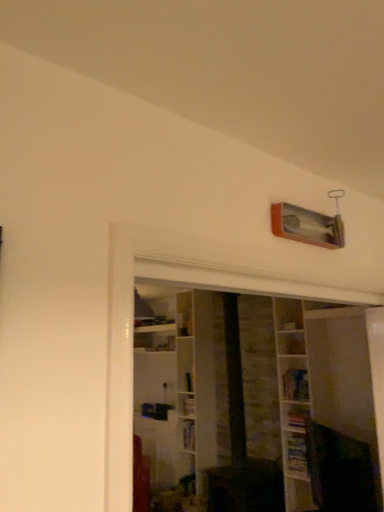
Image resolution: width=384 pixels, height=512 pixels. Identify the location of white wooden shelf at center. (293, 400).

Image resolution: width=384 pixels, height=512 pixels. Describe the element at coordinates (295, 384) in the screenshot. I see `hardcover book at upper center, the 3th book positioned from the bottom` at that location.

This screenshot has height=512, width=384. Describe the element at coordinates (296, 453) in the screenshot. I see `hardcover book at lower right, the 3th book from the top` at that location.

In order to click on hardcover book at lower right, the 3th book from the top in this screenshot , I will do `click(296, 453)`.

Describe the element at coordinates (297, 416) in the screenshot. I see `hardcover book at lower right, placed as the second book when sorted from top to bottom` at that location.

Find the location of a particular element. The image size is (384, 512). white wooden shelf at center is located at coordinates (293, 400).

Is hardcover book at lower right, positioned as the second book in bottom-to-top order, far from hardcover book at lower right, positioned as the 1th book in bottom-to-top order?

No, hardcover book at lower right, positioned as the second book in bottom-to-top order, is not far away from hardcover book at lower right, positioned as the 1th book in bottom-to-top order.

From a real-world perspective, which object rests below the other?

From a 3D spatial view, hardcover book at lower right, positioned as the 1th book in bottom-to-top order, is below.

Which is in front, hardcover book at lower right, positioned as the second book in bottom-to-top order, or hardcover book at lower right, the 3th book from the top?

hardcover book at lower right, the 3th book from the top, is more forward.

In terms of width, does hardcover book at lower right, positioned as the second book in bottom-to-top order, look wider or thinner when compared to hardcover book at lower right, positioned as the 1th book in bottom-to-top order?

Considering their sizes, hardcover book at lower right, positioned as the second book in bottom-to-top order, looks broader than hardcover book at lower right, positioned as the 1th book in bottom-to-top order.

Would you say white wooden shelf at center is a long distance from hardcover book at lower right, placed as the second book when sorted from top to bottom?

That's not correct — white wooden shelf at center is a little close to hardcover book at lower right, placed as the second book when sorted from top to bottom.

Considering the sizes of objects white wooden shelf at center and hardcover book at lower right, placed as the second book when sorted from top to bottom, in the image provided, who is smaller, white wooden shelf at center or hardcover book at lower right, placed as the second book when sorted from top to bottom,?

With smaller size is hardcover book at lower right, placed as the second book when sorted from top to bottom.

Is white wooden shelf at center at the right side of hardcover book at lower right, positioned as the second book in bottom-to-top order?

Yes.

In the image, is white wooden shelf at center positioned in front of or behind hardcover book at lower right, positioned as the second book in bottom-to-top order?

Clearly, white wooden shelf at center is in front of hardcover book at lower right, positioned as the second book in bottom-to-top order.

Where is `shelf in front of the hardcover book at lower right, positioned as the second book in bottom-to-top order`? The width and height of the screenshot is (384, 512). shelf in front of the hardcover book at lower right, positioned as the second book in bottom-to-top order is located at coordinates (293, 400).

From the image's perspective, is hardcover book at lower right, placed as the second book when sorted from top to bottom, under white wooden shelf at center?

Correct, hardcover book at lower right, placed as the second book when sorted from top to bottom, appears lower than white wooden shelf at center in the image.

Is hardcover book at lower right, positioned as the second book in bottom-to-top order, at the left side of white wooden shelf at center?

Correct, you'll find hardcover book at lower right, positioned as the second book in bottom-to-top order, to the left of white wooden shelf at center.

From a real-world perspective, between hardcover book at lower right, placed as the second book when sorted from top to bottom, and hardcover book at upper center, which appears as the 1th book when viewed from the top, who is vertically lower?

hardcover book at lower right, placed as the second book when sorted from top to bottom, is physically lower.

How distant is hardcover book at lower right, placed as the second book when sorted from top to bottom, from hardcover book at upper center, which appears as the 1th book when viewed from the top?

A distance of 6.55 inches exists between hardcover book at lower right, placed as the second book when sorted from top to bottom, and hardcover book at upper center, which appears as the 1th book when viewed from the top.

Which is behind, point (294, 409) or point (296, 393)?

Point (296, 393)

How different are the orientations of hardcover book at lower right, positioned as the second book in bottom-to-top order, and hardcover book at upper center, which appears as the 1th book when viewed from the top, in degrees?

The facing directions of hardcover book at lower right, positioned as the second book in bottom-to-top order, and hardcover book at upper center, which appears as the 1th book when viewed from the top, are 0.0632 degrees apart.

Could you tell me if hardcover book at lower right, the 3th book from the top, is facing white wooden shelf at center?

Yes, hardcover book at lower right, the 3th book from the top, is facing white wooden shelf at center.

Is hardcover book at lower right, the 3th book from the top, touching white wooden shelf at center?

No, hardcover book at lower right, the 3th book from the top, is not touching white wooden shelf at center.

Which point is more distant from viewer, (x=292, y=463) or (x=279, y=333)?

Point (x=279, y=333)

In the image, is hardcover book at lower right, the 3th book from the top, positioned in front of or behind hardcover book at upper center, which appears as the 1th book when viewed from the top?

hardcover book at lower right, the 3th book from the top, is positioned closer to the viewer than hardcover book at upper center, which appears as the 1th book when viewed from the top.

Is hardcover book at lower right, positioned as the 1th book in bottom-to-top order, to the left of hardcover book at upper center, which appears as the 1th book when viewed from the top, from the viewer's perspective?

Yes, hardcover book at lower right, positioned as the 1th book in bottom-to-top order, is to the left of hardcover book at upper center, which appears as the 1th book when viewed from the top.

From a real-world perspective, who is located lower, hardcover book at lower right, positioned as the 1th book in bottom-to-top order, or hardcover book at upper center, which appears as the 1th book when viewed from the top?

From a 3D spatial view, hardcover book at lower right, positioned as the 1th book in bottom-to-top order, is below.

Is hardcover book at lower right, positioned as the 1th book in bottom-to-top order, in contact with hardcover book at upper center, which appears as the 1th book when viewed from the top?

hardcover book at lower right, positioned as the 1th book in bottom-to-top order, and hardcover book at upper center, which appears as the 1th book when viewed from the top, are not in contact.

Considering the relative sizes of hardcover book at upper center, the 3th book positioned from the bottom, and hardcover book at lower right, positioned as the second book in bottom-to-top order, in the image provided, is hardcover book at upper center, the 3th book positioned from the bottom, shorter than hardcover book at lower right, positioned as the second book in bottom-to-top order,?

Incorrect, the height of hardcover book at upper center, the 3th book positioned from the bottom, does not fall short of that of hardcover book at lower right, positioned as the second book in bottom-to-top order.

Who is bigger, hardcover book at upper center, which appears as the 1th book when viewed from the top, or hardcover book at lower right, placed as the second book when sorted from top to bottom?

hardcover book at upper center, which appears as the 1th book when viewed from the top, is bigger.

Considering the sizes of objects hardcover book at upper center, which appears as the 1th book when viewed from the top, and hardcover book at lower right, placed as the second book when sorted from top to bottom, in the image provided, who is thinner, hardcover book at upper center, which appears as the 1th book when viewed from the top, or hardcover book at lower right, placed as the second book when sorted from top to bottom,?

With smaller width is hardcover book at lower right, placed as the second book when sorted from top to bottom.

From the image's perspective, which object appears higher, hardcover book at upper center, the 3th book positioned from the bottom, or hardcover book at lower right, placed as the second book when sorted from top to bottom?

From the image's view, hardcover book at upper center, the 3th book positioned from the bottom, is above.

Where is `book below the hardcover book at lower right, positioned as the second book in bottom-to-top order (from the image's perspective)`? This screenshot has width=384, height=512. book below the hardcover book at lower right, positioned as the second book in bottom-to-top order (from the image's perspective) is located at coordinates (296, 453).

I want to click on shelf that is above the hardcover book at lower right, placed as the second book when sorted from top to bottom (from a real-world perspective), so click(x=293, y=400).

Looking at this image, which object lies nearer to the anchor point white wooden shelf at center, hardcover book at upper center, the 3th book positioned from the bottom, or hardcover book at lower right, positioned as the second book in bottom-to-top order?

Among the two, hardcover book at upper center, the 3th book positioned from the bottom, is located nearer to white wooden shelf at center.

Which object lies further to the anchor point white wooden shelf at center, hardcover book at lower right, placed as the second book when sorted from top to bottom, or hardcover book at upper center, which appears as the 1th book when viewed from the top?

hardcover book at lower right, placed as the second book when sorted from top to bottom.

Considering their positions, is hardcover book at lower right, placed as the second book when sorted from top to bottom, positioned closer to white wooden shelf at center than hardcover book at lower right, the 3th book from the top?

hardcover book at lower right, the 3th book from the top, is closer to white wooden shelf at center.

When comparing their distances from hardcover book at upper center, the 3th book positioned from the bottom, does hardcover book at lower right, the 3th book from the top, or hardcover book at lower right, positioned as the second book in bottom-to-top order, seem closer?

hardcover book at lower right, positioned as the second book in bottom-to-top order, is positioned closer to the anchor hardcover book at upper center, the 3th book positioned from the bottom.

Based on their spatial positions, is white wooden shelf at center or hardcover book at lower right, placed as the second book when sorted from top to bottom, further from hardcover book at upper center, the 3th book positioned from the bottom?

white wooden shelf at center.

Looking at this image, based on their spatial positions, is hardcover book at lower right, positioned as the second book in bottom-to-top order, or white wooden shelf at center further from hardcover book at upper center, which appears as the 1th book when viewed from the top?

white wooden shelf at center is further to hardcover book at upper center, which appears as the 1th book when viewed from the top.

Estimate the real-world distances between objects in this image. Which object is further from white wooden shelf at center, hardcover book at lower right, positioned as the 1th book in bottom-to-top order, or hardcover book at lower right, positioned as the second book in bottom-to-top order?

Among the two, hardcover book at lower right, positioned as the second book in bottom-to-top order, is located further to white wooden shelf at center.

Considering their positions, is hardcover book at lower right, the 3th book from the top, positioned closer to hardcover book at lower right, positioned as the second book in bottom-to-top order, than white wooden shelf at center?

hardcover book at lower right, the 3th book from the top.

Where is `book between white wooden shelf at center and hardcover book at lower right, the 3th book from the top, from top to bottom`? This screenshot has height=512, width=384. book between white wooden shelf at center and hardcover book at lower right, the 3th book from the top, from top to bottom is located at coordinates (297, 416).

This screenshot has width=384, height=512. I want to click on book between hardcover book at upper center, the 3th book positioned from the bottom, and hardcover book at lower right, positioned as the 1th book in bottom-to-top order, in the vertical direction, so [x=297, y=416].

The height and width of the screenshot is (512, 384). I want to click on shelf between hardcover book at upper center, the 3th book positioned from the bottom, and hardcover book at lower right, positioned as the 1th book in bottom-to-top order, from top to bottom, so click(293, 400).